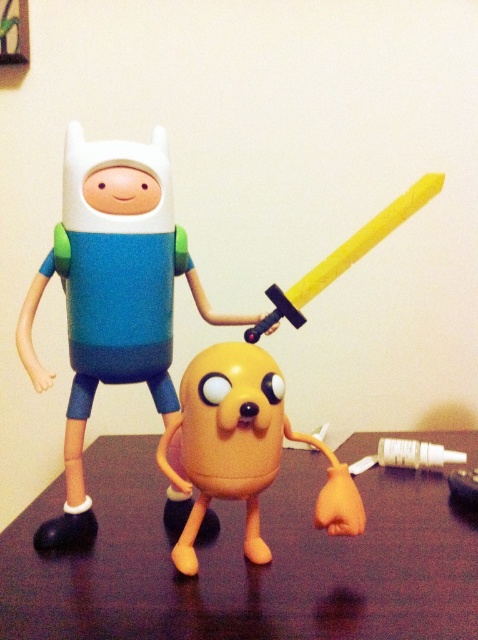
Question: Does matte plastic figure at center have a smaller size compared to orange matte/jellybean at center?

Choices:
 (A) no
 (B) yes

Answer: (A)

Question: Which of the following is the farthest from the observer?

Choices:
 (A) brown wooden table at center
 (B) matte plastic figure at center
 (C) orange matte/jellybean at center

Answer: (B)

Question: Is brown wooden table at center below matte plastic figure at center?

Choices:
 (A) no
 (B) yes

Answer: (B)

Question: Which point is farther from the camera taking this photo?

Choices:
 (A) (86, 248)
 (B) (329, 620)
 (C) (238, 390)

Answer: (A)

Question: Which of these objects is positioned farthest from the matte plastic figure at center?

Choices:
 (A) brown wooden table at center
 (B) orange matte/jellybean at center

Answer: (A)

Question: Can you confirm if brown wooden table at center is positioned above orange matte/jellybean at center?

Choices:
 (A) no
 (B) yes

Answer: (A)